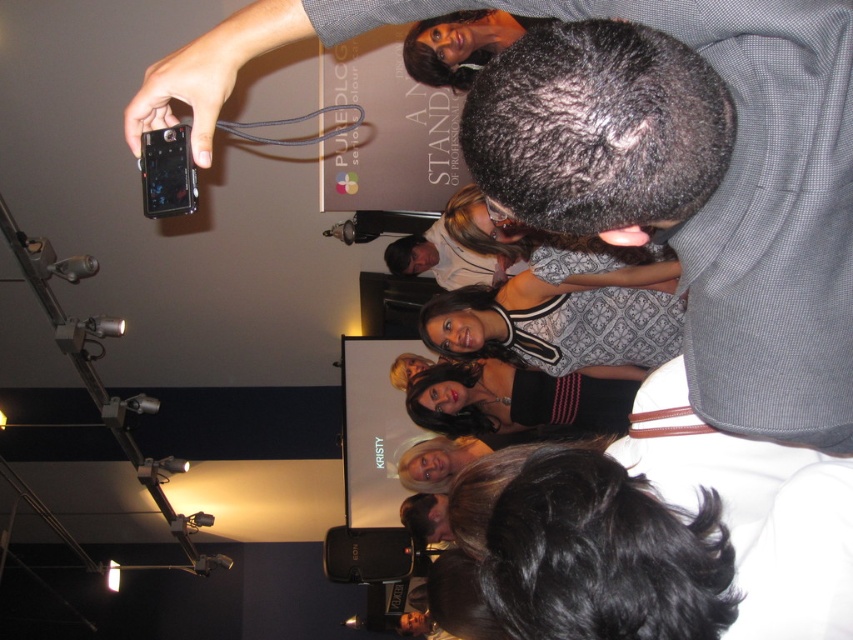
Is gray textured shirt at upper right taller than matte black smartphone at upper left?

Correct, gray textured shirt at upper right is much taller as matte black smartphone at upper left.

Who is more distant from viewer, (x=775, y=3) or (x=151, y=211)?

Positioned behind is point (x=151, y=211).

Is point (639, 216) in front of point (183, 131)?

Yes, it is.

Find the location of `gray textured shirt at upper right`. gray textured shirt at upper right is located at coordinates (699, 180).